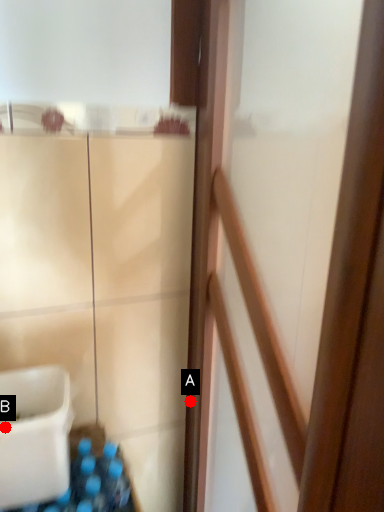
Question: Two points are circled on the image, labeled by A and B beside each circle. Which point is farther from the camera taking this photo?

Choices:
 (A) A is further
 (B) B is further

Answer: (A)